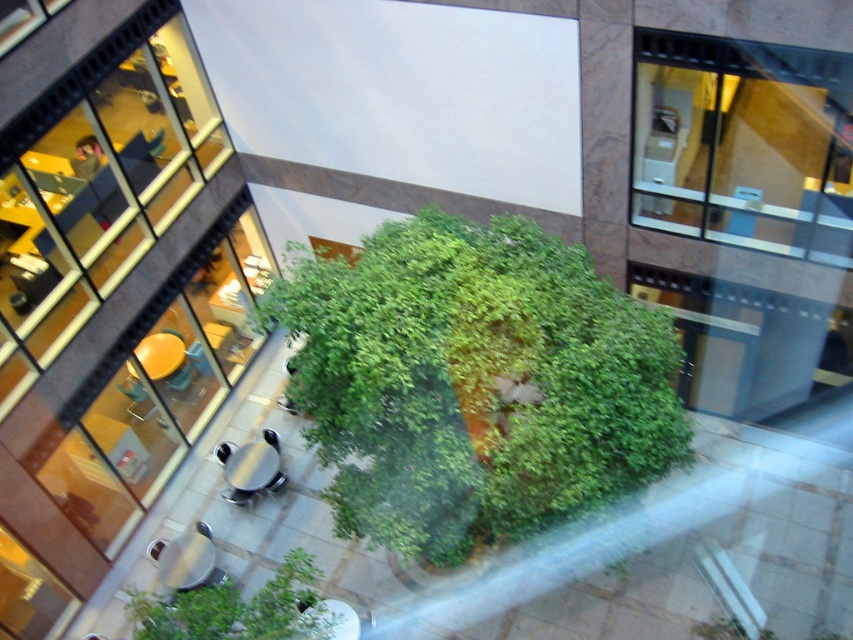
Is green leafy bush at center to the left of green leafy bush at lower center from the viewer's perspective?

Incorrect, green leafy bush at center is not on the left side of green leafy bush at lower center.

Where is `green leafy bush at center`? green leafy bush at center is located at coordinates (474, 384).